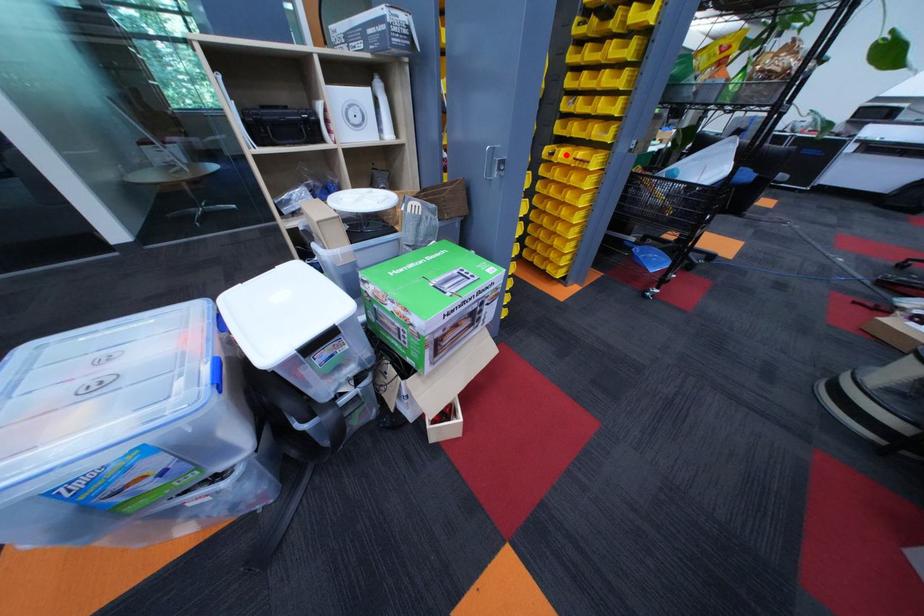
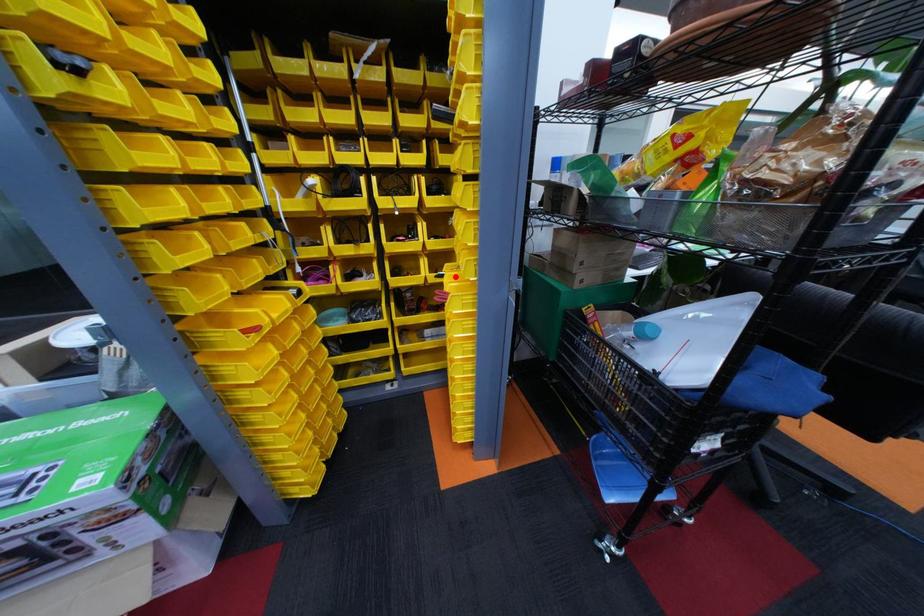
I am providing you with two images of the same scene from different viewpoints. A red point is marked on the first image and another point is marked on the second image. Does the point marked in image1 correspond to the same location as the one in image2?

Yes